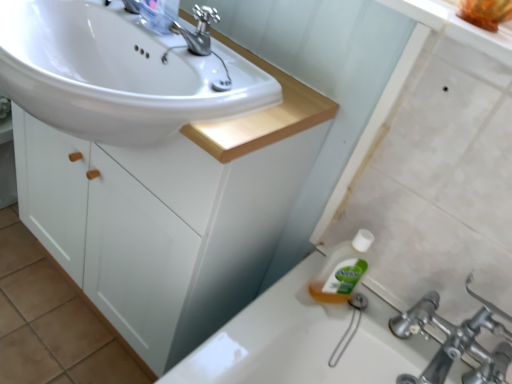
Question: Is white glossy sink at upper left located outside polished metallic faucet at upper center?

Choices:
 (A) no
 (B) yes

Answer: (B)

Question: Does white glossy sink at upper left come in front of polished metallic faucet at upper center?

Choices:
 (A) no
 (B) yes

Answer: (B)

Question: Could you tell me if white glossy sink at upper left is facing polished metallic faucet at upper center?

Choices:
 (A) no
 (B) yes

Answer: (A)

Question: From the image's perspective, is white glossy sink at upper left located beneath polished metallic faucet at upper center?

Choices:
 (A) no
 (B) yes

Answer: (B)

Question: Considering the relative sizes of white glossy sink at upper left and polished metallic faucet at upper center in the image provided, is white glossy sink at upper left smaller than polished metallic faucet at upper center?

Choices:
 (A) no
 (B) yes

Answer: (A)

Question: Is white glossy sink at upper left situated inside clear plastic bottle at upper center or outside?

Choices:
 (A) inside
 (B) outside

Answer: (B)

Question: Visually, is white glossy sink at upper left positioned to the left or to the right of clear plastic bottle at upper center?

Choices:
 (A) right
 (B) left

Answer: (B)

Question: Considering the positions of point (174, 69) and point (140, 13), is point (174, 69) closer or farther from the camera than point (140, 13)?

Choices:
 (A) farther
 (B) closer

Answer: (B)

Question: From the image's perspective, relative to clear plastic bottle at upper center, is white glossy sink at upper left above or below?

Choices:
 (A) below
 (B) above

Answer: (A)

Question: Would you say clear plastic bottle at upper center is to the left or to the right of polished metallic faucet at upper center in the picture?

Choices:
 (A) left
 (B) right

Answer: (A)

Question: Considering their positions, is clear plastic bottle at upper center located in front of or behind polished metallic faucet at upper center?

Choices:
 (A) behind
 (B) front

Answer: (A)

Question: From a real-world perspective, relative to polished metallic faucet at upper center, is clear plastic bottle at upper center vertically above or below?

Choices:
 (A) below
 (B) above

Answer: (B)

Question: Considering the positions of clear plastic bottle at upper center and polished metallic faucet at upper center in the image, is clear plastic bottle at upper center taller or shorter than polished metallic faucet at upper center?

Choices:
 (A) short
 (B) tall

Answer: (B)

Question: Is white matte cabinet at center wider or thinner than clear plastic bottle at upper center?

Choices:
 (A) wide
 (B) thin

Answer: (A)

Question: Is white matte cabinet at center taller or shorter than clear plastic bottle at upper center?

Choices:
 (A) tall
 (B) short

Answer: (A)